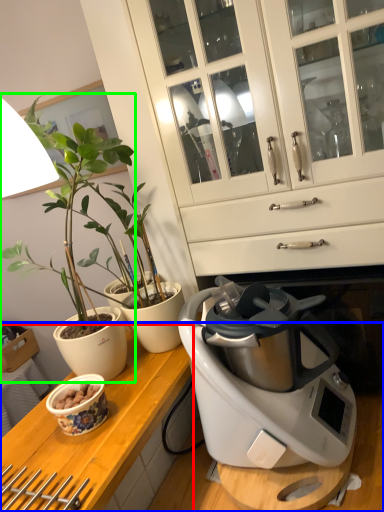
Question: Based on their relative distances, which object is nearer to counter top (highlighted by a red box)? Choose from countertop (highlighted by a blue box) and houseplant (highlighted by a green box).

Choices:
 (A) countertop
 (B) houseplant

Answer: (A)